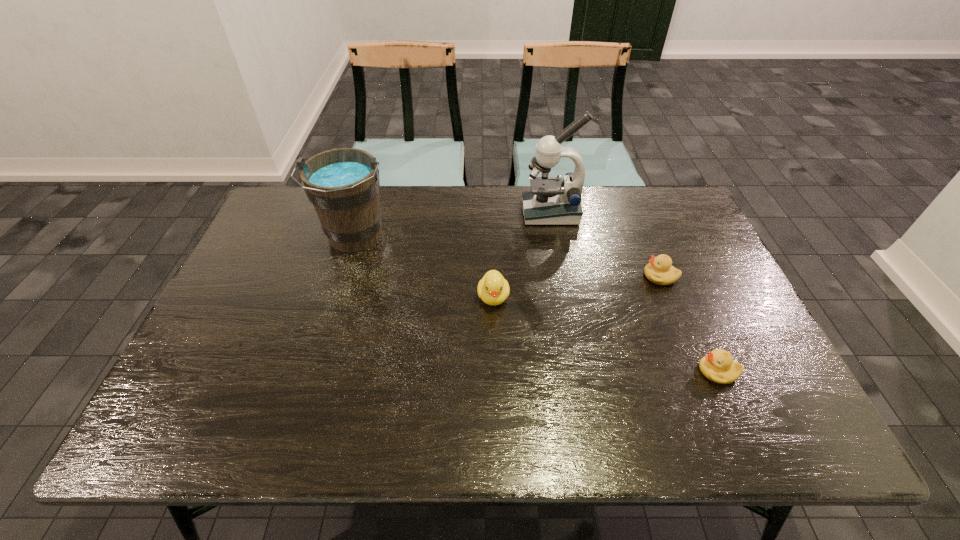
Locate which duckling is the second closest to the second object from left to right. Please provide its 2D coordinates. Your answer should be formatted as a tuple, i.e. [(x, y)], where the tuple contains the x and y coordinates of a point satisfying the conditions above.

[(718, 366)]